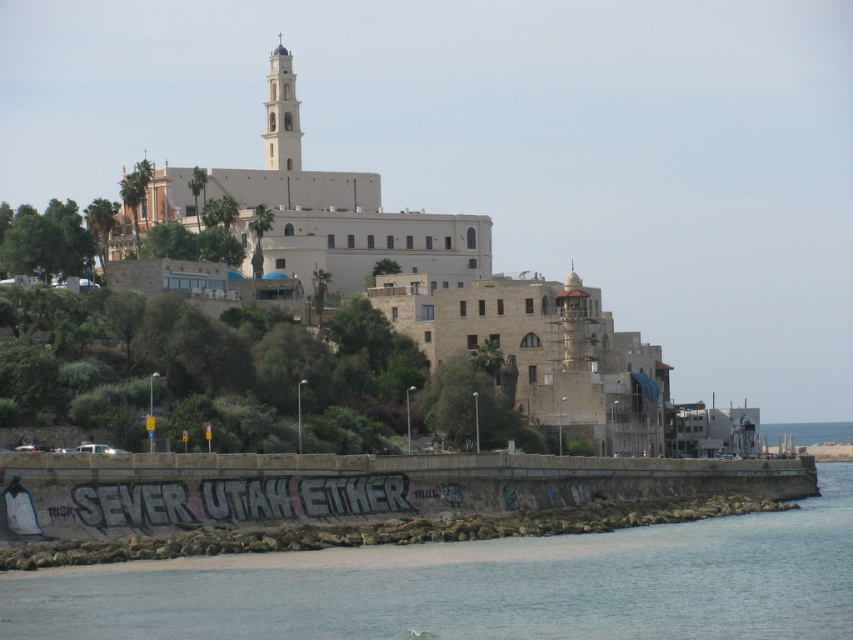
You are a photographer standing on the rocky shoreline near the concrete seawall. You want to take a photo of the white stone tower at upper center and the blue water at lower right. Which object will appear closer to the camera in your photo?

The white stone tower at upper center will appear closer to the camera in the photo because it is positioned in front of the blue water at lower right.

You are standing at the base of the hill looking up at the historic building. There are two points marked on the seawall in the foreground. Which point, point 1 at coordinates point (212, 582) or point 2 at coordinates point (287, 113), is closer to you?

Point 1 at coordinates point (212, 582) is closer to you than point 2 at coordinates point (287, 113).

You are a swimmer planning to jump into the water near the concrete seawall. The clear water at lower left and blue water at lower right are both visible from where you stand. Which area of water would you choose to jump into if you want to avoid rough waves?

The clear water at lower left is larger in size than blue water at lower right, so it is more likely to have calmer waters and less rough waves compared to the smaller blue water at lower right. Therefore, you should choose the clear water at lower left to jump into.